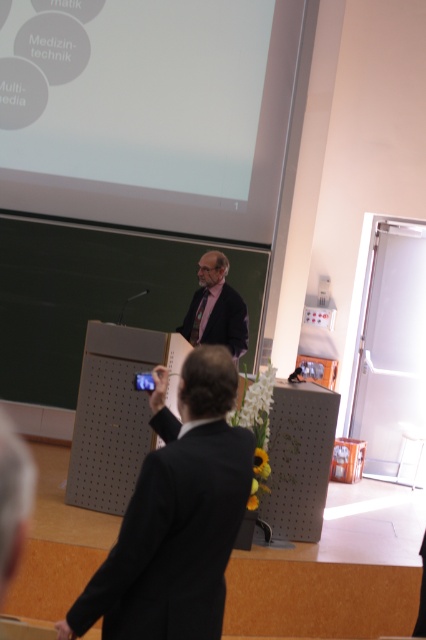
Is point (192, 221) in front of point (241, 307)?

No.

Locate an element on the screen. This screenshot has width=426, height=640. white matte projection screen at upper center is located at coordinates (189, 195).

Is black matte suit at center below dark suit at center?

Indeed, black matte suit at center is positioned under dark suit at center.

Between point (141, 497) and point (193, 324), which one is positioned in front?

Positioned in front is point (141, 497).

Find the location of a particular element. black matte suit at center is located at coordinates (173, 538).

Is black matte suit at center shorter than white matte projection screen at upper center?

Yes.

Can you confirm if black matte suit at center is bigger than white matte projection screen at upper center?

Incorrect, black matte suit at center is not larger than white matte projection screen at upper center.

This screenshot has width=426, height=640. In order to click on black matte suit at center in this screenshot , I will do `click(173, 538)`.

Identify the location of black matte suit at center. (173, 538).